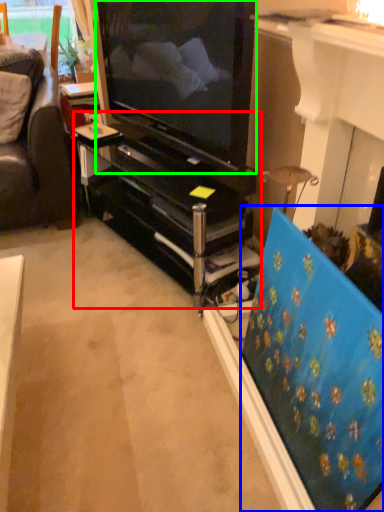
Question: Which is farther away from tv cabinet (highlighted by a red box)? flat (highlighted by a blue box) or television (highlighted by a green box)?

Choices:
 (A) flat
 (B) television

Answer: (A)